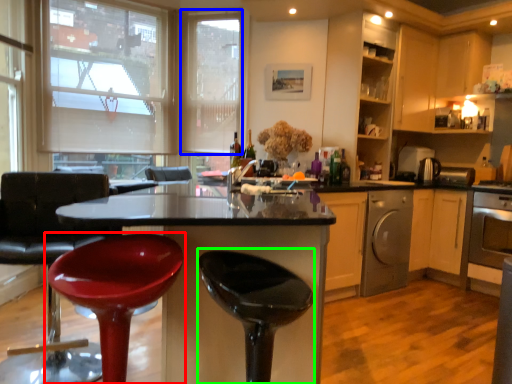
Question: Based on their relative distances, which object is farther from chair (highlighted by a red box)? Choose from window screen (highlighted by a blue box) and bar stool (highlighted by a green box).

Choices:
 (A) window screen
 (B) bar stool

Answer: (A)